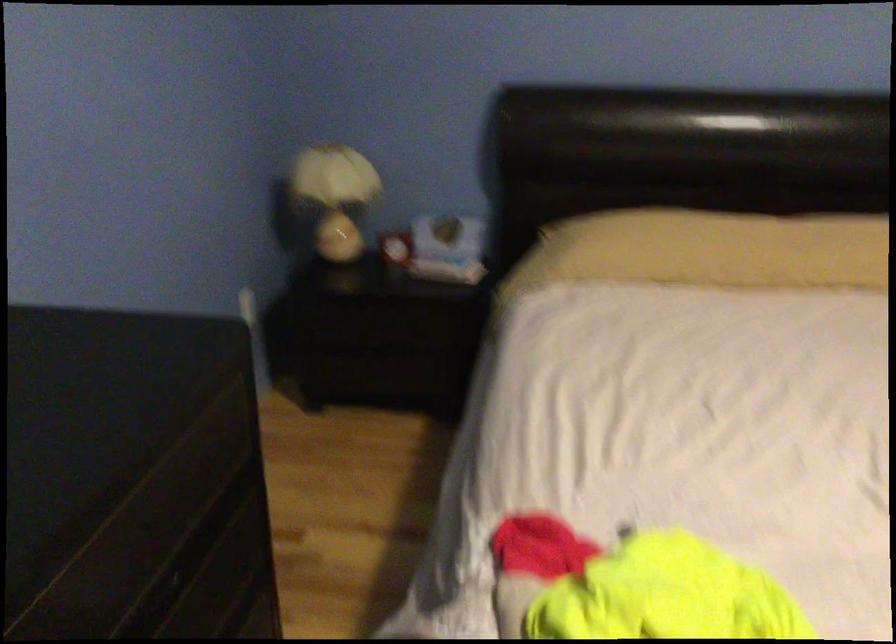
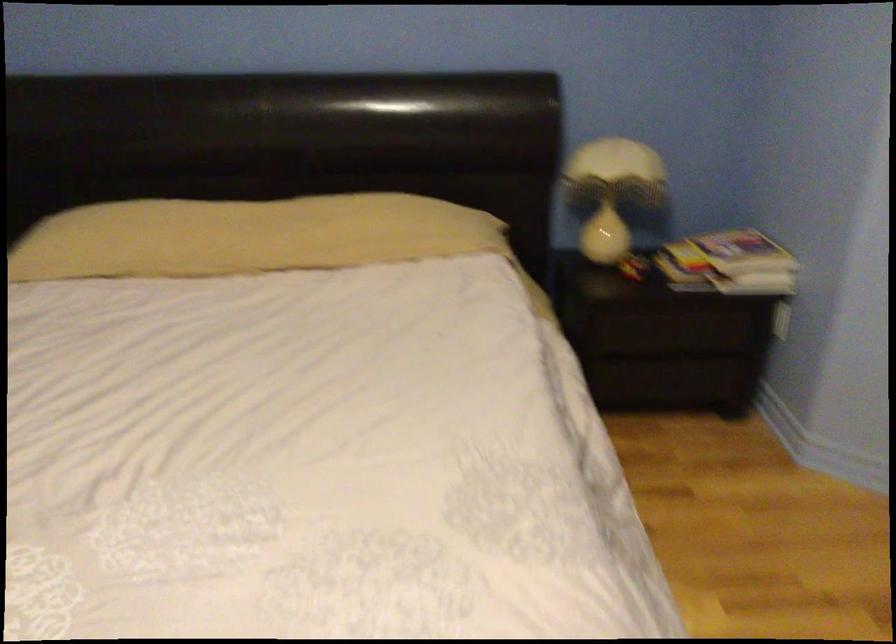
The point at (793, 245) is marked in the first image. Where is the corresponding point in the second image?

(247, 236)